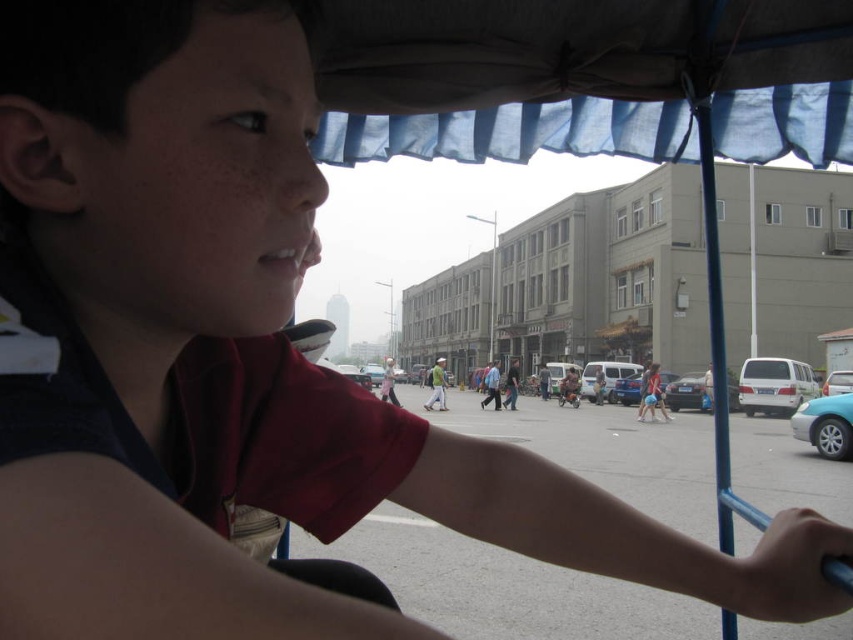
Question: Is blue fabric shirt at center above light blue shirt at center?

Choices:
 (A) no
 (B) yes

Answer: (A)

Question: Observing the image, what is the correct spatial positioning of shiny silver sedan at center in reference to light blue shirt at center?

Choices:
 (A) above
 (B) below

Answer: (B)

Question: Which object is positioned farthest from the blue metallic car at center?

Choices:
 (A) shiny silver sedan at center
 (B) metallic blue sedan at right

Answer: (B)

Question: Estimate the real-world distances between objects in this image. Which object is closer to the light brown leather jacket at center?

Choices:
 (A) metallic blue sedan at right
 (B) light blue shirt at center
 (C) blue fabric canopy at upper center

Answer: (B)

Question: Considering the relative positions of metallic blue sedan at right and light blue shirt at center in the image provided, where is metallic blue sedan at right located with respect to light blue shirt at center?

Choices:
 (A) left
 (B) right

Answer: (B)

Question: Which object is positioned farthest from the blue fabric canopy at upper center?

Choices:
 (A) blue fabric shirt at center
 (B) light blue shirt at center
 (C) blue metallic car at center
 (D) metallic silver sedan at lower right

Answer: (C)